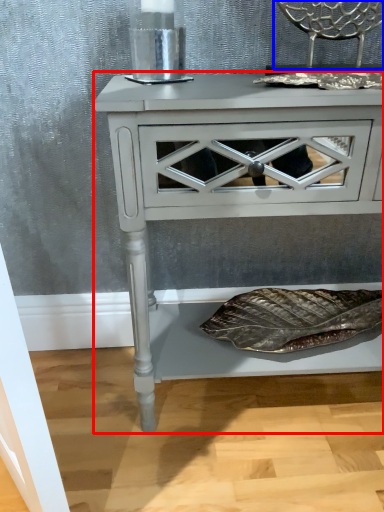
Question: Which object is closer to the camera taking this photo, nightstand (highlighted by a red box) or chair (highlighted by a blue box)?

Choices:
 (A) nightstand
 (B) chair

Answer: (A)